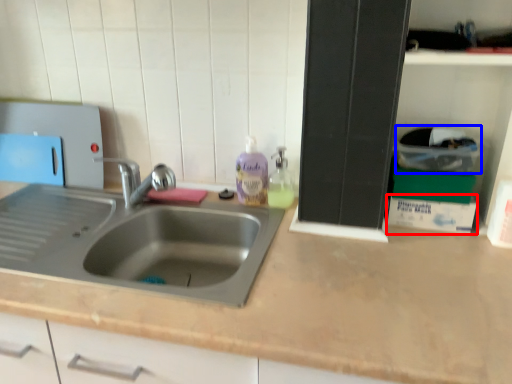
Question: Among these objects, which one is farthest to the camera, box (highlighted by a red box) or box (highlighted by a blue box)?

Choices:
 (A) box
 (B) box

Answer: (A)